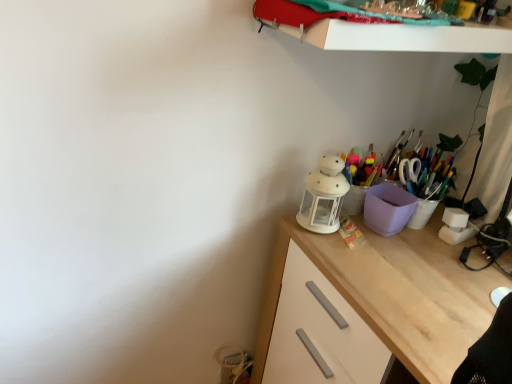
Question: Would you say white glossy shelf at upper center is outside light wood desk at lower right?

Choices:
 (A) no
 (B) yes

Answer: (B)

Question: Is white glossy shelf at upper center to the left of light wood desk at lower right from the viewer's perspective?

Choices:
 (A) yes
 (B) no

Answer: (A)

Question: Does white glossy shelf at upper center have a greater height compared to light wood desk at lower right?

Choices:
 (A) no
 (B) yes

Answer: (A)

Question: From a real-world perspective, is white glossy shelf at upper center located beneath light wood desk at lower right?

Choices:
 (A) yes
 (B) no

Answer: (B)

Question: Is white glossy shelf at upper center at the right side of light wood desk at lower right?

Choices:
 (A) no
 (B) yes

Answer: (A)

Question: Is white glossy shelf at upper center shorter than light wood desk at lower right?

Choices:
 (A) no
 (B) yes

Answer: (B)

Question: Does light wood desk at lower right appear on the left side of white glossy shelf at upper center?

Choices:
 (A) yes
 (B) no

Answer: (B)

Question: Is light wood desk at lower right smaller than white glossy shelf at upper center?

Choices:
 (A) yes
 (B) no

Answer: (B)

Question: Is light wood desk at lower right facing away from white glossy shelf at upper center?

Choices:
 (A) no
 (B) yes

Answer: (A)

Question: Is light wood desk at lower right at the right side of white glossy shelf at upper center?

Choices:
 (A) yes
 (B) no

Answer: (A)

Question: Considering the relative sizes of light wood desk at lower right and white glossy shelf at upper center in the image provided, is light wood desk at lower right thinner than white glossy shelf at upper center?

Choices:
 (A) yes
 (B) no

Answer: (B)

Question: From a real-world perspective, is light wood desk at lower right physically below white glossy shelf at upper center?

Choices:
 (A) no
 (B) yes

Answer: (B)

Question: In terms of size, does light wood desk at lower right appear bigger or smaller than white glossy shelf at upper center?

Choices:
 (A) small
 (B) big

Answer: (B)